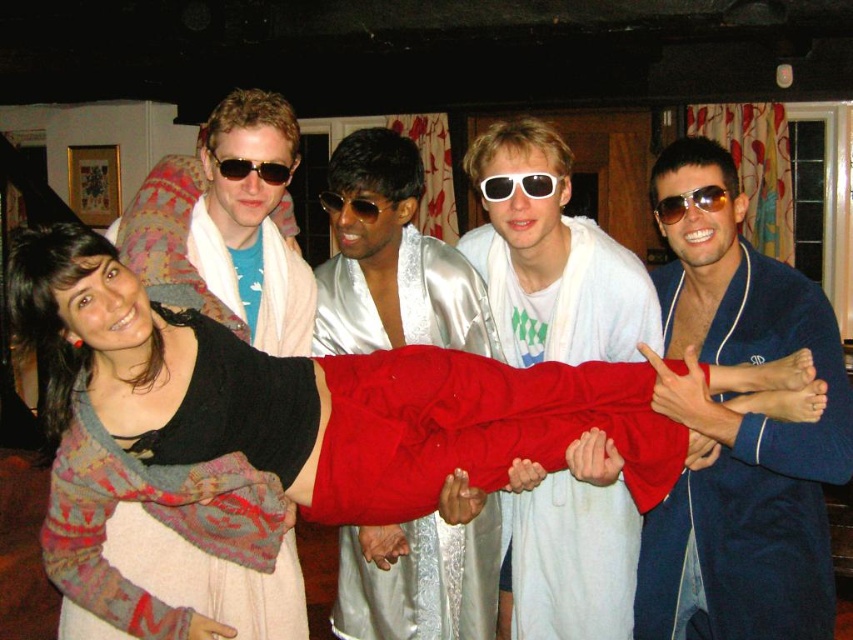
Which is in front, point (103, 490) or point (273, 182)?

Point (103, 490) is more forward.

Can you confirm if knitted wool dress at lower left is positioned below matte white towel at upper left?

Yes, knitted wool dress at lower left is below matte white towel at upper left.

What do you see at coordinates (170, 547) in the screenshot?
I see `knitted wool dress at lower left` at bounding box center [170, 547].

At what (x,y) coordinates should I click in order to perform the action: click on knitted wool dress at lower left. Please return your answer as a coordinate pair (x, y). The image size is (853, 640). Looking at the image, I should click on (170, 547).

Is matte white towel at upper left thinner than black reflective sunglasses at center?

In fact, matte white towel at upper left might be wider than black reflective sunglasses at center.

Between matte white towel at upper left and black reflective sunglasses at center, which one is positioned higher?

Positioned higher is black reflective sunglasses at center.

The image size is (853, 640). What do you see at coordinates (239, 218) in the screenshot?
I see `matte white towel at upper left` at bounding box center [239, 218].

Where is `matte white towel at upper left`? The image size is (853, 640). matte white towel at upper left is located at coordinates (239, 218).

Is knitted wool dress at lower left taller than black reflective sunglasses at center?

Yes, knitted wool dress at lower left is taller than black reflective sunglasses at center.

Can you confirm if knitted wool dress at lower left is wider than black reflective sunglasses at center?

Yes, knitted wool dress at lower left is wider than black reflective sunglasses at center.

Locate an element on the screen. knitted wool dress at lower left is located at coordinates (170, 547).